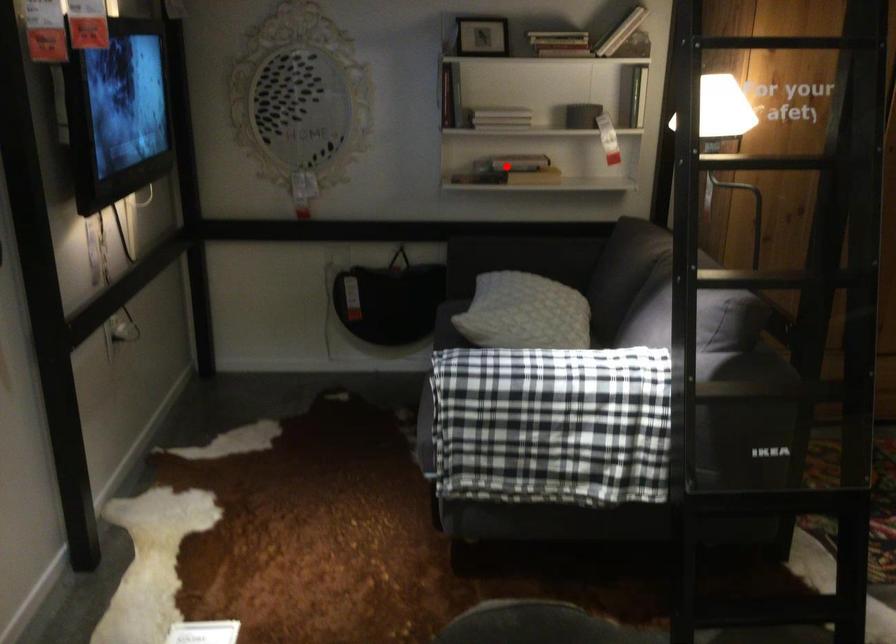
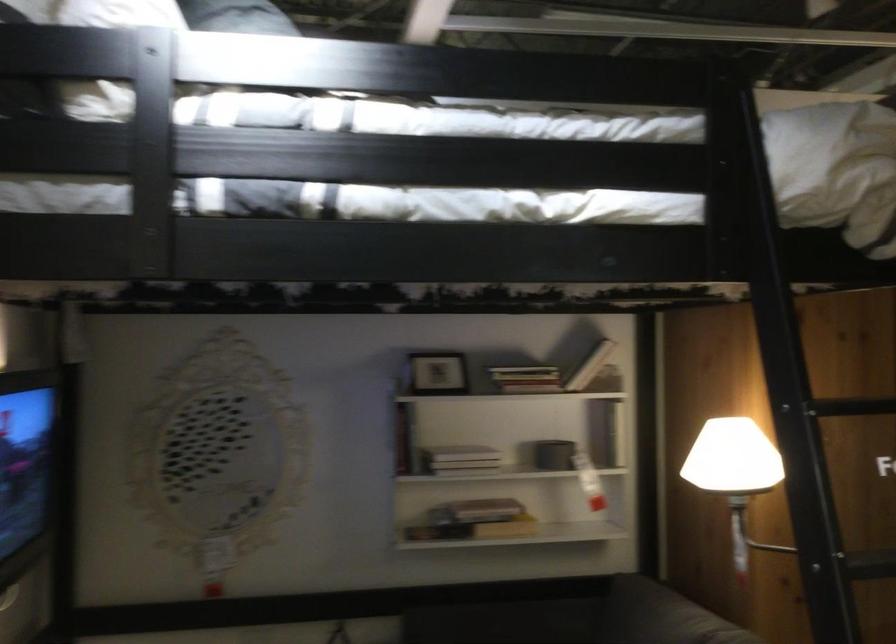
Question: I am providing you with two images of the same scene from different viewpoints. A red point is shown in image1. For the corresponding object point in image2, is it positioned nearer or farther from the camera?

Choices:
 (A) Nearer
 (B) Farther

Answer: (A)